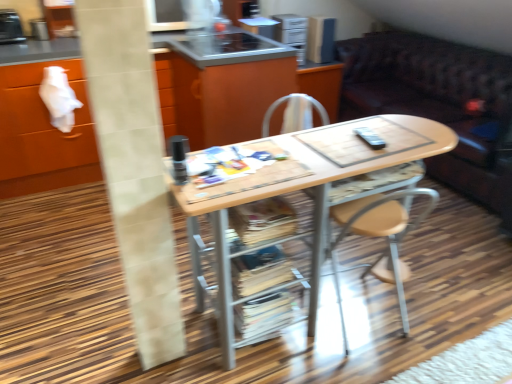
Question: In terms of size, does metallic stainless steel toaster at upper left, placed as the third appliance when sorted from back to front, appear bigger or smaller than metallic silver microwave at upper center, arranged as the second appliance when viewed from the left?

Choices:
 (A) small
 (B) big

Answer: (B)

Question: From the image's perspective, is metallic stainless steel toaster at upper left, arranged as the 3th appliance when viewed from the right, located above or below metallic silver microwave at upper center, which is the second appliance in back-to-front order?

Choices:
 (A) above
 (B) below

Answer: (B)

Question: Which of these objects is positioned farthest from the white tile pillar at left?

Choices:
 (A) wooden/matte desk at center
 (B) wooden cabinet at center
 (C) brown leather couch at center
 (D) metallic silver microwave at upper center, acting as the second appliance starting from the front
 (E) metallic stainless steel toaster at upper left, placed as the third appliance when sorted from back to front

Answer: (D)

Question: Which object is positioned farthest from the metallic silver microwave at upper center, which is the second appliance in back-to-front order?

Choices:
 (A) metallic silver toaster at upper center, the 3th appliance viewed from the left
 (B) wooden cabinet at center
 (C) brown leather couch at center
 (D) metallic stainless steel toaster at upper left, arranged as the 3th appliance when viewed from the right
 (E) white tile pillar at left

Answer: (E)